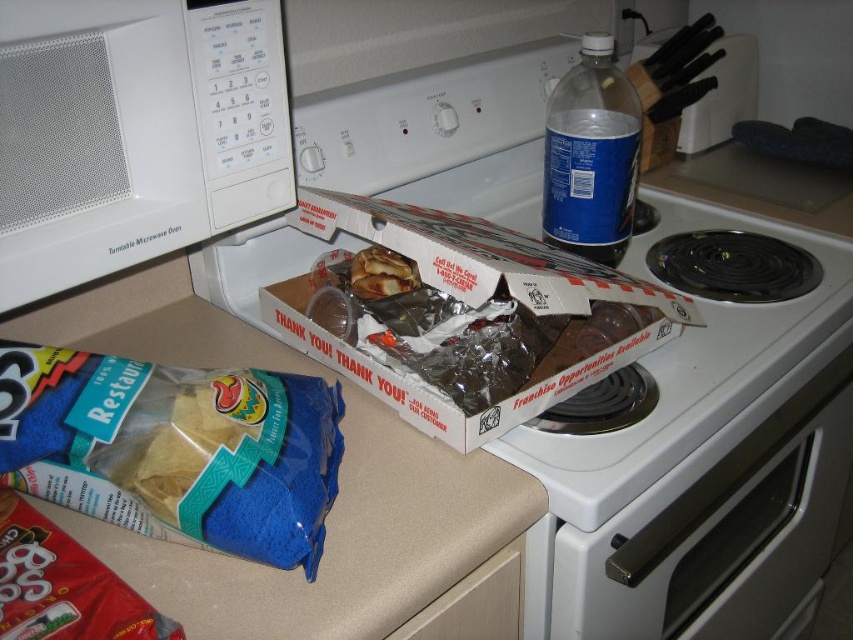
You have a 12 inch long spatula that you need to place between the beige laminate countertop at lower center and the white glossy oven at lower right. Will it fit without overlapping either surface?

The distance between the beige laminate countertop at lower center and the white glossy oven at lower right is 15.51 inches. Since the spatula is only 12 inches long, it will fit comfortably between them without overlapping either surface.

You are a chef preparing to place a heavy pot on the kitchen surface. You have the option to put it on the beige laminate countertop at lower center or the white glossy oven at lower right. Which surface is more suitable for supporting the pot based on their heights?

The white glossy oven at lower right is taller than the beige laminate countertop at lower center. Since the oven has a greater height, it might provide a more stable and level surface for placing the heavy pot, ensuring it doesn

In the scene shown: You need to place a 10 inch ruler between the white cardboard box at center and the blue plastic bottle at upper right. Will the ruler fit entirely between them?

The distance between the white cardboard box at center and the blue plastic bottle at upper right is 9.58 inches. Since the ruler is 10 inches long, it will not fit entirely between them as the space is slightly shorter than the ruler.